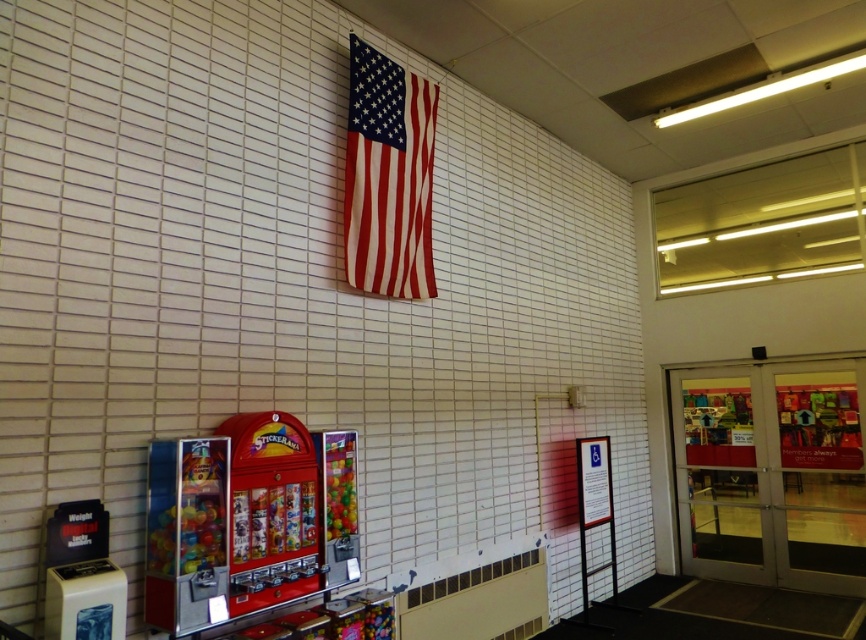
Can you confirm if matte fabric flag at upper center is shorter than shiny red vending machine at center?

No.

Looking at this image, does matte fabric flag at upper center appear over shiny red vending machine at center?

Correct, matte fabric flag at upper center is located above shiny red vending machine at center.

Who is more forward, (427, 204) or (240, 573)?

Point (240, 573) is in front.

Locate an element on the screen. matte fabric flag at upper center is located at coordinates (388, 177).